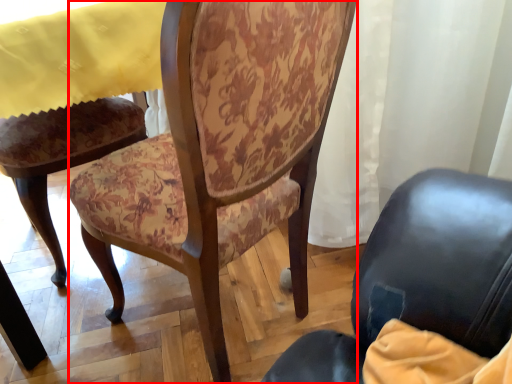
Question: From the image's perspective, where is chair (annotated by the red box) located relative to tablecloth?

Choices:
 (A) below
 (B) above

Answer: (A)